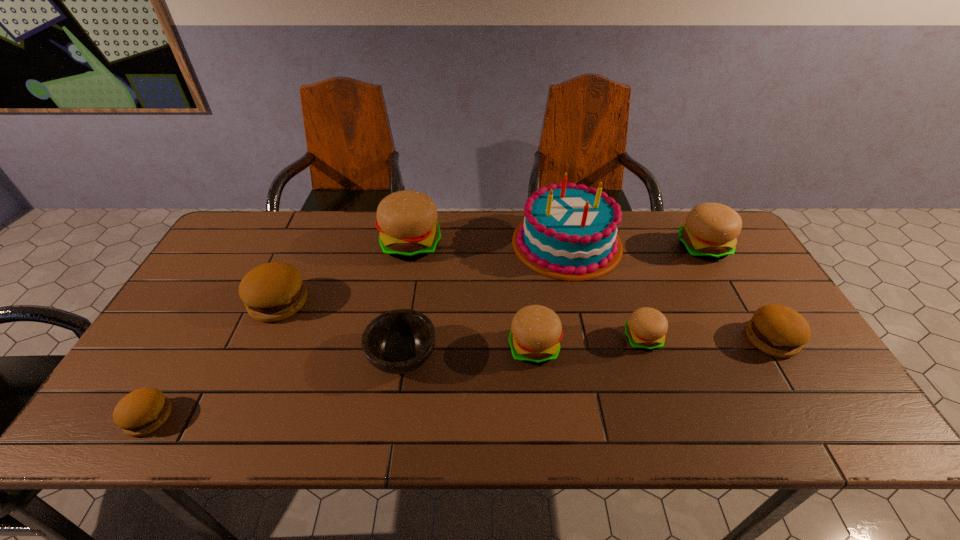
Find the location of a particular element. brown hamburger that stands as the second closest to the tallest hamburger is located at coordinates (142, 411).

Select which brown hamburger is the closest to the third hamburger from left to right. Please provide its 2D coordinates. Your answer should be formatted as a tuple, i.e. [(x, y)], where the tuple contains the x and y coordinates of a point satisfying the conditions above.

[(274, 291)]

Locate an element on the screen. Image resolution: width=960 pixels, height=540 pixels. vacant region that satisfies the following two spatial constraints: 1. on the back side of the fifth hamburger from right to left; 2. on the left side of the shortest hamburger is located at coordinates (250, 245).